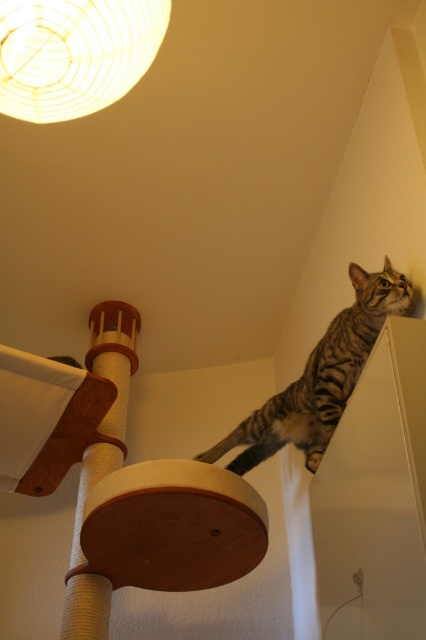
Question: Can you confirm if tabby fur cat at upper right is thinner than sisal-covered scratching post at lower left?

Choices:
 (A) yes
 (B) no

Answer: (B)

Question: Can you confirm if tabby fur cat at upper right is bigger than sisal-covered scratching post at lower left?

Choices:
 (A) no
 (B) yes

Answer: (B)

Question: Does tabby fur cat at upper right appear under sisal-covered scratching post at lower left?

Choices:
 (A) yes
 (B) no

Answer: (B)